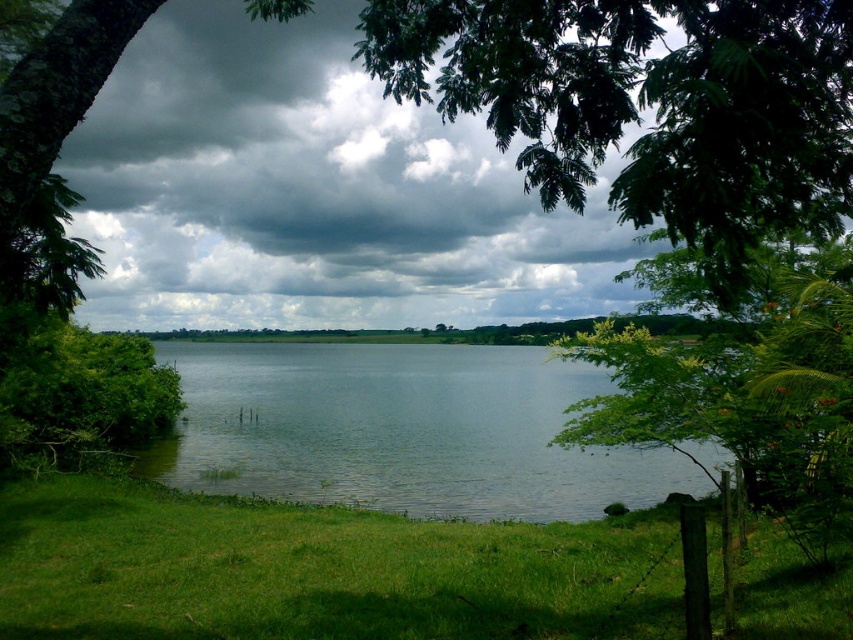
Question: Is green grass at lower left to the left of clear water at center from the viewer's perspective?

Choices:
 (A) yes
 (B) no

Answer: (B)

Question: Which of the following is the farthest from the observer?

Choices:
 (A) (10, 579)
 (B) (401, 440)

Answer: (B)

Question: Is green grass at lower left thinner than clear water at center?

Choices:
 (A) no
 (B) yes

Answer: (B)

Question: Is the position of green grass at lower left less distant than that of clear water at center?

Choices:
 (A) yes
 (B) no

Answer: (A)

Question: Which object appears farthest from the camera in this image?

Choices:
 (A) clear water at center
 (B) green grass at lower left

Answer: (A)